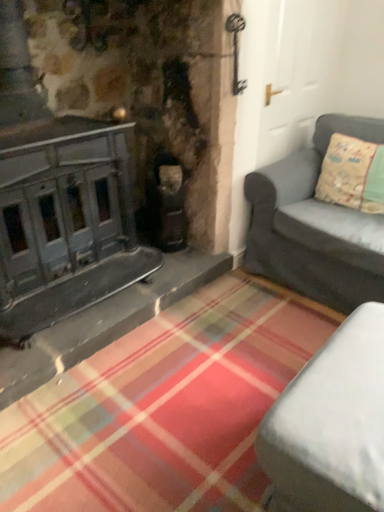
Image resolution: width=384 pixels, height=512 pixels. Find the location of `vacant point above white fabric studio couch at lower right, which appears as the second studio couch when viewed from the back (from a real-world perspective)`. vacant point above white fabric studio couch at lower right, which appears as the second studio couch when viewed from the back (from a real-world perspective) is located at coordinates (353, 381).